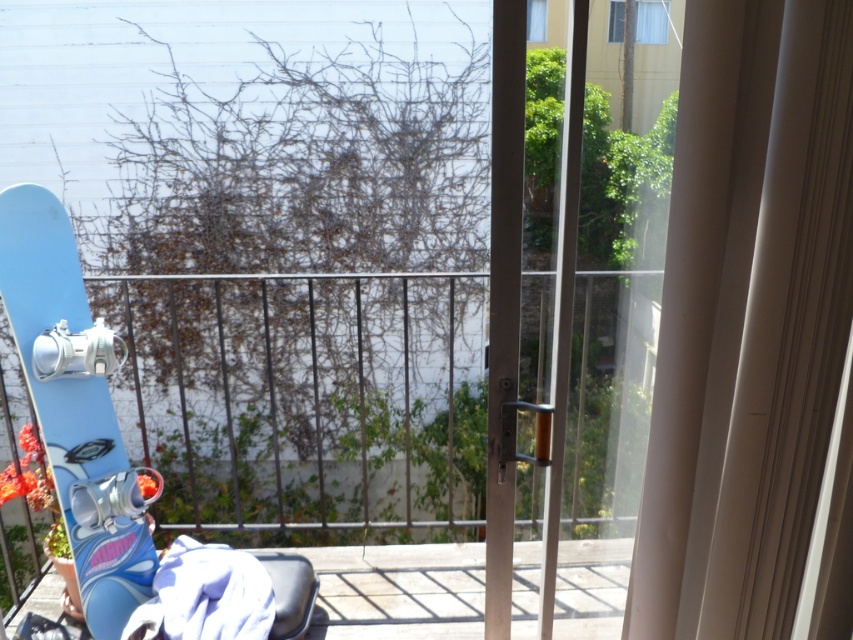
You are standing on the balcony and want to move from the snowboard to the draped towel. Which point should you step on first, point (x=669, y=154) or point (x=64, y=308)?

You should step on point (x=669, y=154) first because it is in front of point (x=64, y=308).

You are trying to move the blue glossy snowboard at left through the transparent glass door at center. Based on their widths, will the snowboard fit through the door horizontally?

The blue glossy snowboard at left is wider than the transparent glass door at center, so it will not fit through the door horizontally.

You are a delivery person trying to bring a large package through the transparent glass door at center. The package is as tall as the blue glossy snowboard at left. Will the package fit through the door vertically?

The blue glossy snowboard at left has a lesser height compared to the transparent glass door at center. Since the package is as tall as the snowboard, it will be shorter than the door. Therefore, the package can fit through the door vertically.